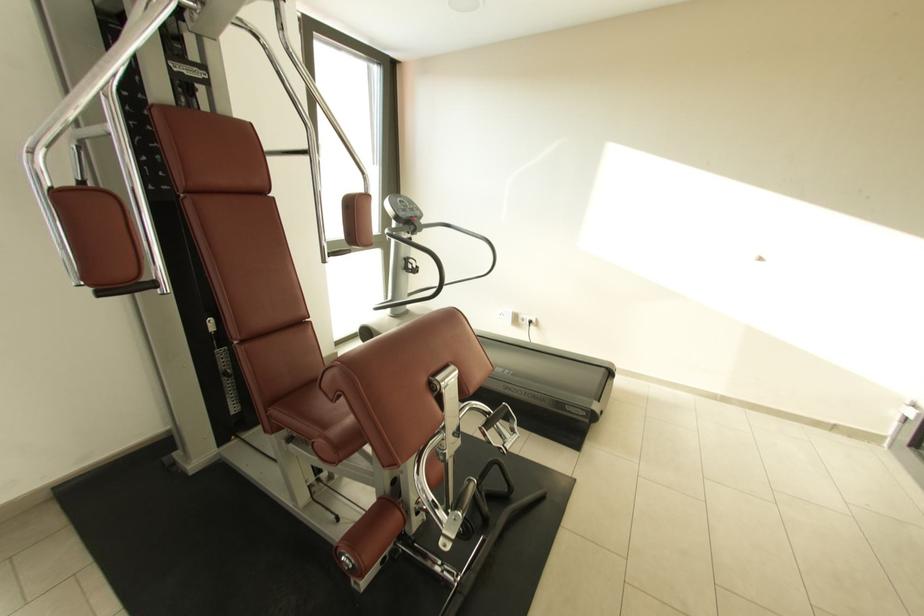
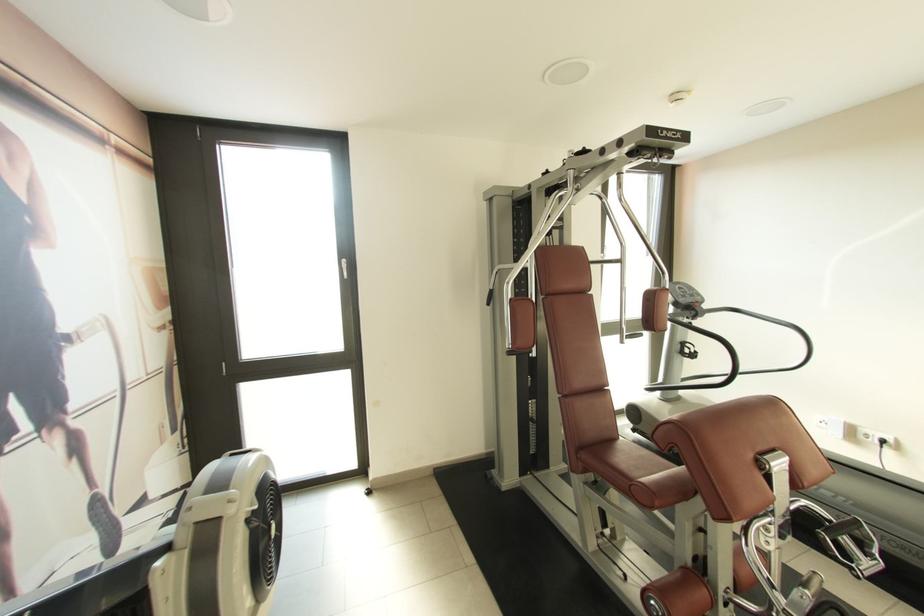
Where in the second image is the point corresponding to (532,323) from the first image?

(882, 445)